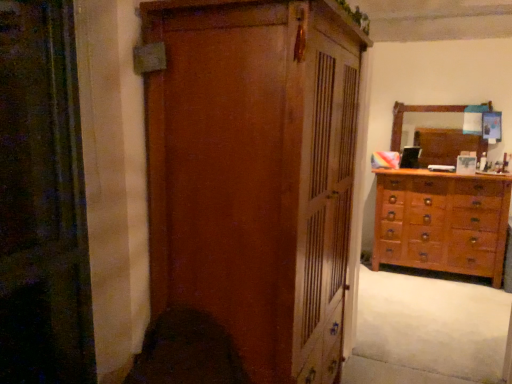
Question: From a real-world perspective, is wooden dresser at right under wooden mirror at upper right?

Choices:
 (A) no
 (B) yes

Answer: (B)

Question: Is wooden dresser at right outside wooden mirror at upper right?

Choices:
 (A) no
 (B) yes

Answer: (B)

Question: Is the depth of wooden dresser at right greater than that of wooden mirror at upper right?

Choices:
 (A) yes
 (B) no

Answer: (B)

Question: Are wooden dresser at right and wooden mirror at upper right far apart?

Choices:
 (A) yes
 (B) no

Answer: (B)

Question: Considering the relative positions of wooden dresser at right and wooden mirror at upper right in the image provided, is wooden dresser at right to the left of wooden mirror at upper right from the viewer's perspective?

Choices:
 (A) no
 (B) yes

Answer: (B)

Question: Does wooden dresser at right have a lesser height compared to wooden mirror at upper right?

Choices:
 (A) no
 (B) yes

Answer: (A)

Question: Does wooden mirror at upper right have a smaller size compared to white soft carpet at lower right?

Choices:
 (A) yes
 (B) no

Answer: (A)

Question: Does wooden mirror at upper right come behind white soft carpet at lower right?

Choices:
 (A) no
 (B) yes

Answer: (B)

Question: Are wooden mirror at upper right and white soft carpet at lower right beside each other?

Choices:
 (A) no
 (B) yes

Answer: (A)

Question: Does wooden mirror at upper right have a larger size compared to white soft carpet at lower right?

Choices:
 (A) no
 (B) yes

Answer: (A)

Question: Can you confirm if wooden mirror at upper right is thinner than white soft carpet at lower right?

Choices:
 (A) yes
 (B) no

Answer: (A)

Question: Is wooden mirror at upper right located outside white soft carpet at lower right?

Choices:
 (A) no
 (B) yes

Answer: (B)

Question: From the image's perspective, would you say wooden wardrobe at center is shown under wooden mirror at upper right?

Choices:
 (A) yes
 (B) no

Answer: (A)